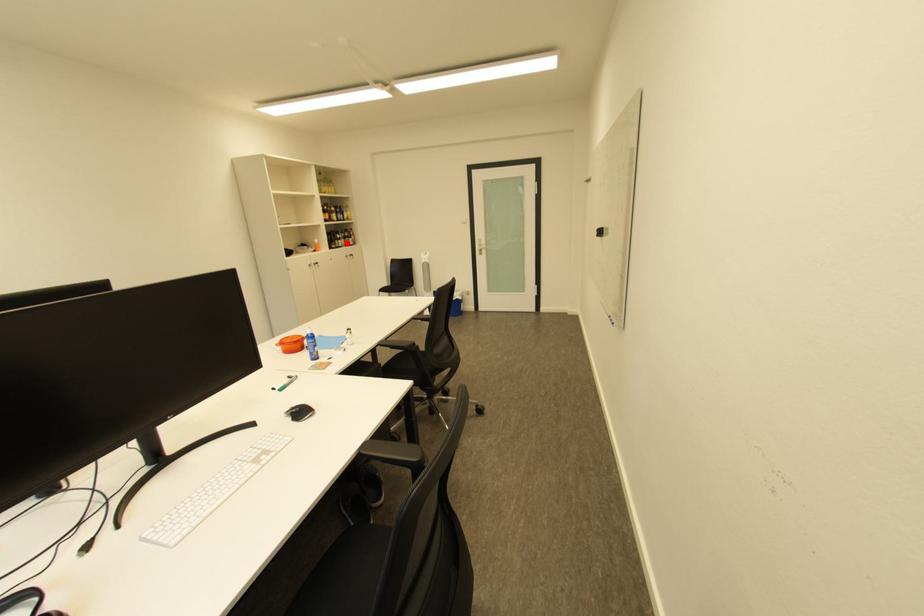
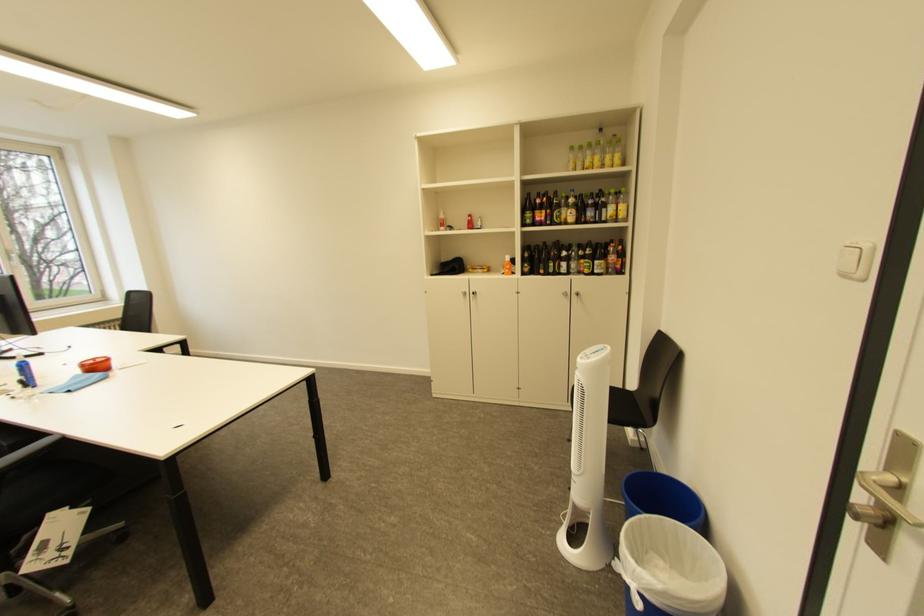
Question: I am providing you with two images of the same scene from different viewpoints. Image1 has a red point marked. In image2, the corresponding 3D location appears at what relative position? Reply with the corresponding letter.

Choices:
 (A) Closer
 (B) Farther

Answer: (B)